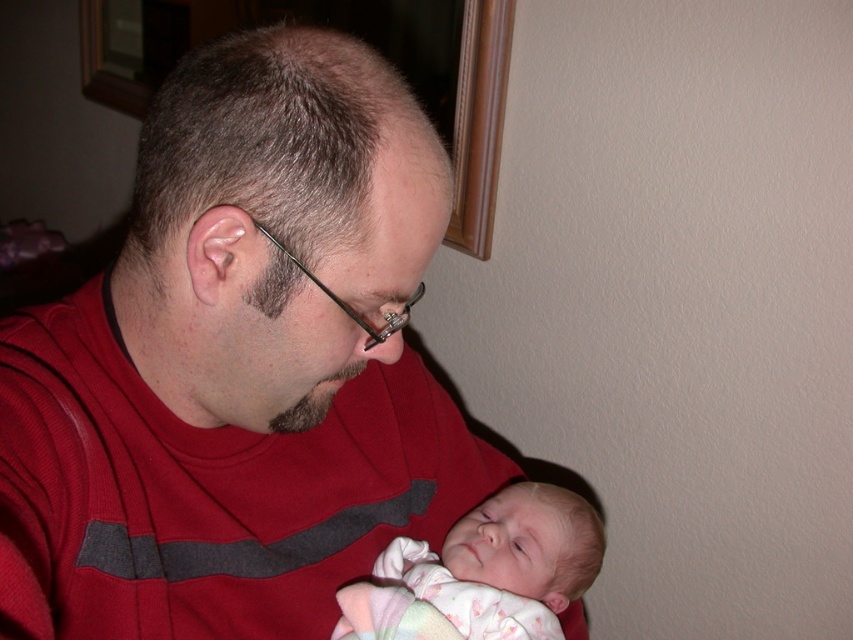
Question: Which object is closer to the camera taking this photo?

Choices:
 (A) soft pink fabric at center
 (B) matte red shirt at center

Answer: (B)

Question: Is the position of matte red shirt at center more distant than that of soft pink fabric at center?

Choices:
 (A) yes
 (B) no

Answer: (B)

Question: Which point is closer to the camera taking this photo?

Choices:
 (A) (546, 506)
 (B) (126, 305)

Answer: (B)

Question: Which of the following is the closest to the observer?

Choices:
 (A) (361, 44)
 (B) (544, 493)

Answer: (A)

Question: Is matte red shirt at center wider than soft pink fabric at center?

Choices:
 (A) yes
 (B) no

Answer: (A)

Question: Is matte red shirt at center to the right of soft pink fabric at center from the viewer's perspective?

Choices:
 (A) no
 (B) yes

Answer: (A)